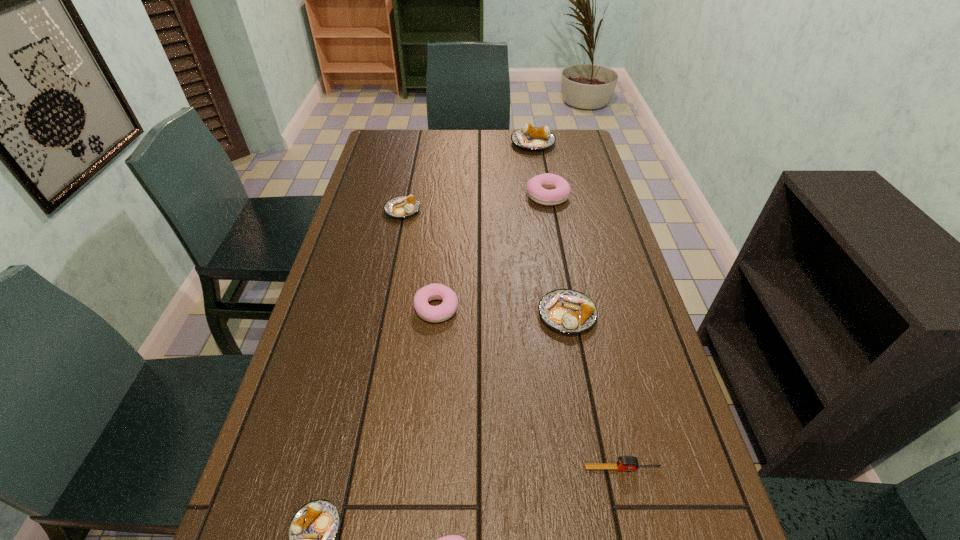
Where is `free space located 0.250m on the left of the rightmost pink pastry`? The width and height of the screenshot is (960, 540). free space located 0.250m on the left of the rightmost pink pastry is located at coordinates (453, 195).

Locate an element on the screen. This screenshot has width=960, height=540. free space located 0.120m on the right of the third farthest brown pastry is located at coordinates (642, 315).

Locate an element on the screen. This screenshot has width=960, height=540. free spot located on the front of the second biggest pink pastry is located at coordinates (433, 349).

This screenshot has height=540, width=960. In order to click on free location located 0.260m on the front of the second farthest brown pastry in this screenshot , I will do `click(389, 278)`.

I want to click on free space located on the right of the black tape measure, so click(701, 468).

This screenshot has height=540, width=960. I want to click on object at the far edge, so click(x=531, y=138).

Find the location of a particular element. This screenshot has height=540, width=960. object present at the left edge is located at coordinates (401, 206).

Locate an element on the screen. tape measure that is at the right edge is located at coordinates (625, 463).

Locate an element on the screen. object that is positioned at the far right corner is located at coordinates (531, 138).

Image resolution: width=960 pixels, height=540 pixels. In the image, there is a desktop. What are the coordinates of `blank space at the far edge` in the screenshot? It's located at (504, 158).